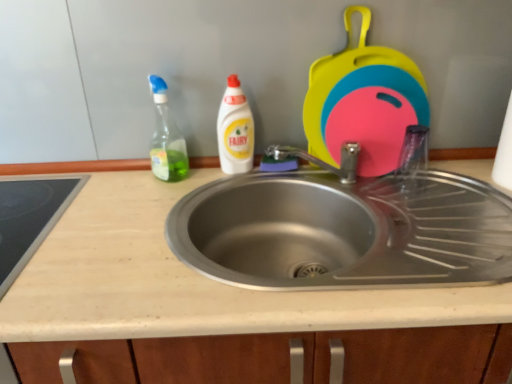
The height and width of the screenshot is (384, 512). Identify the location of blank space situated above beige laminate countertop at center (from a real-world perspective). (196, 197).